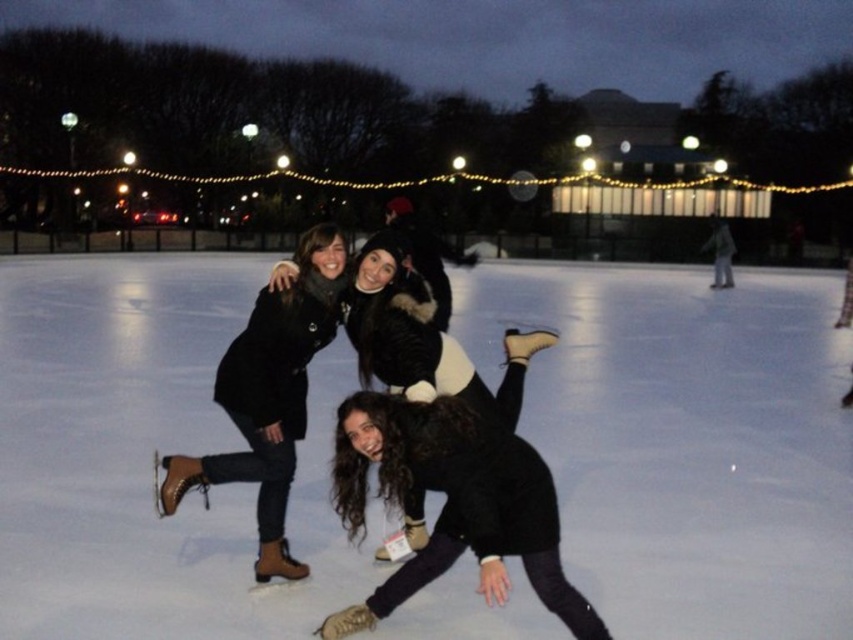
Between point (357, 566) and point (561, 614), which one is positioned in front?

Positioned in front is point (561, 614).

Which is above, white ice skating rink at center or black fuzzy jacket at lower center?

Positioned higher is white ice skating rink at center.

Is point (502, 268) positioned before point (532, 568)?

No, it is not.

Image resolution: width=853 pixels, height=640 pixels. What are the coordinates of `white ice skating rink at center` in the screenshot? It's located at (685, 440).

Can you confirm if black fuzzy jacket at lower center is wider than matte brown boots at center?

No.

Can you confirm if black fuzzy jacket at lower center is thinner than matte brown boots at center?

Correct, black fuzzy jacket at lower center's width is less than matte brown boots at center's.

What do you see at coordinates (450, 502) in the screenshot?
I see `black fuzzy jacket at lower center` at bounding box center [450, 502].

Locate an element on the screen. Image resolution: width=853 pixels, height=640 pixels. black fuzzy jacket at lower center is located at coordinates (450, 502).

Which is in front, point (119, 499) or point (167, 476)?

Point (167, 476)

Measure the distance between white ice skating rink at center and camera.

They are 4.22 meters apart.

Between point (727, 577) and point (296, 307), which one is positioned behind?

The point (727, 577) is more distant.

You are a GUI agent. You are given a task and a screenshot of the screen. Output one action in this format:
    pyautogui.click(x=<x>, y=<y>)
    Task: Click on the white ice skating rink at center
    
    Given the screenshot: What is the action you would take?
    pyautogui.click(x=685, y=440)